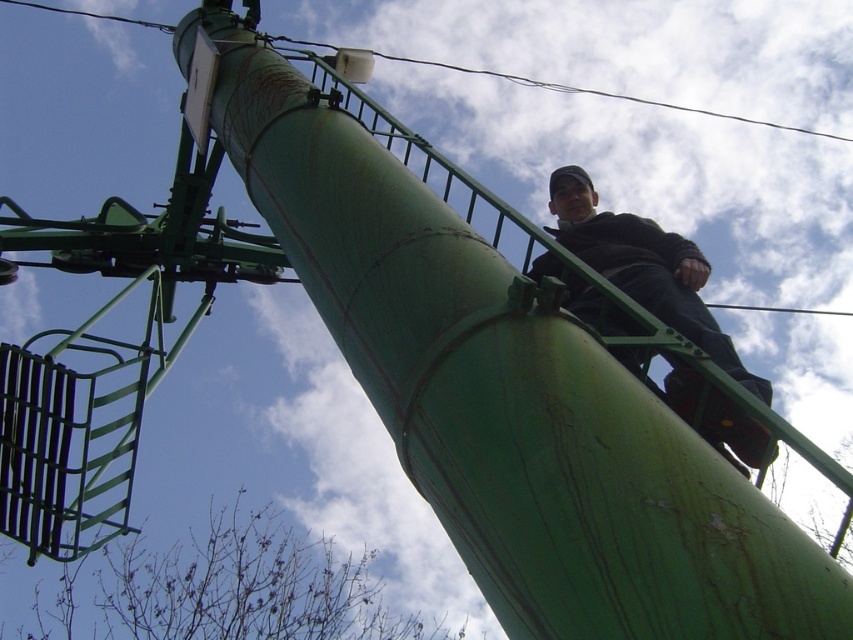
You are a photographer trying to capture the black matte jacket at upper right in the center of your photo. The photo frame is divided into a grid with coordinates from 0 to 1 on both axes. What adjustment should you make to the camera position to center the jacket?

The black matte jacket at upper right is located at point 0.419 on the x axis and 0.756 on the y axis. To center it, move the camera so the jacket is at the center coordinates of 0.5 on both axes. This means moving the camera slightly to the right along the x axis since 0.419 is left of center, and slightly down along the y axis since 0.756 is above center.

You are a photographer trying to capture a clear shot of the black matte jacket at upper right and the green painted metal pole at upper center. Which object is closer to the camera lens?

The black matte jacket at upper right is positioned under the green painted metal pole at upper center, so the green painted metal pole at upper center is closer to the camera lens.